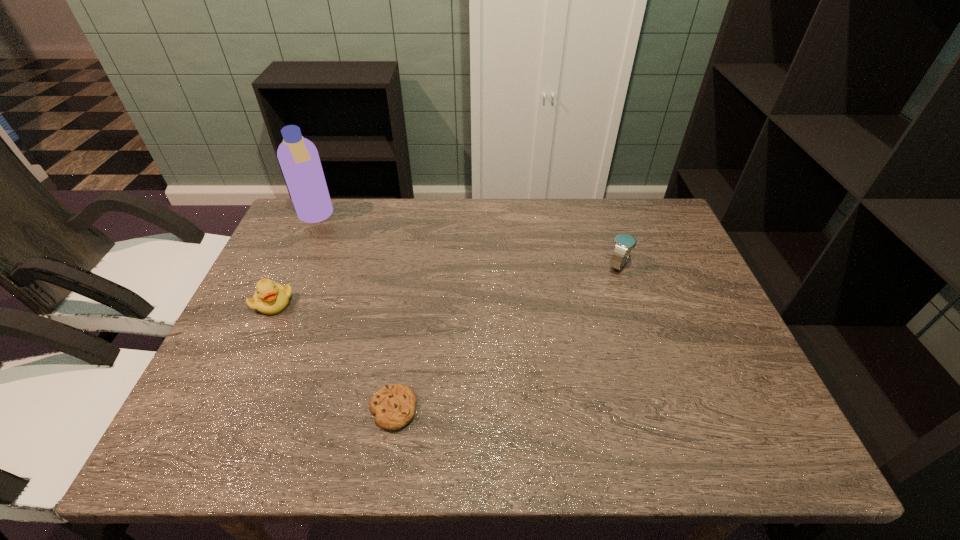
In the image, there is a desktop. Identify the location of vacant space at the far left corner. (326, 243).

Where is `vacant region at the near right corner of the desktop`? The image size is (960, 540). vacant region at the near right corner of the desktop is located at coordinates (694, 416).

I want to click on unoccupied position between the farthest object and the duckling, so click(x=295, y=260).

Locate an element on the screen. vacant space in between the nearest object and the watch is located at coordinates (506, 337).

You are a GUI agent. You are given a task and a screenshot of the screen. Output one action in this format:
    pyautogui.click(x=<x>, y=<y>)
    Task: Click on the vacant point located between the rightmost object and the tallest object
    This screenshot has width=960, height=540.
    Given the screenshot: What is the action you would take?
    click(x=468, y=241)

Find the location of `free area in between the third nearest object and the cookie`. free area in between the third nearest object and the cookie is located at coordinates (506, 337).

Find the location of a particular element. This screenshot has height=540, width=960. empty space between the third farthest object and the shortest object is located at coordinates (333, 356).

Identify the location of vacant space that's between the watch and the tallest object. (468, 241).

Where is `vacant space that's between the rightmost object and the shortest object`? vacant space that's between the rightmost object and the shortest object is located at coordinates (506, 337).

Locate an element on the screen. This screenshot has width=960, height=540. vacant region between the shampoo and the third farthest object is located at coordinates (295, 260).